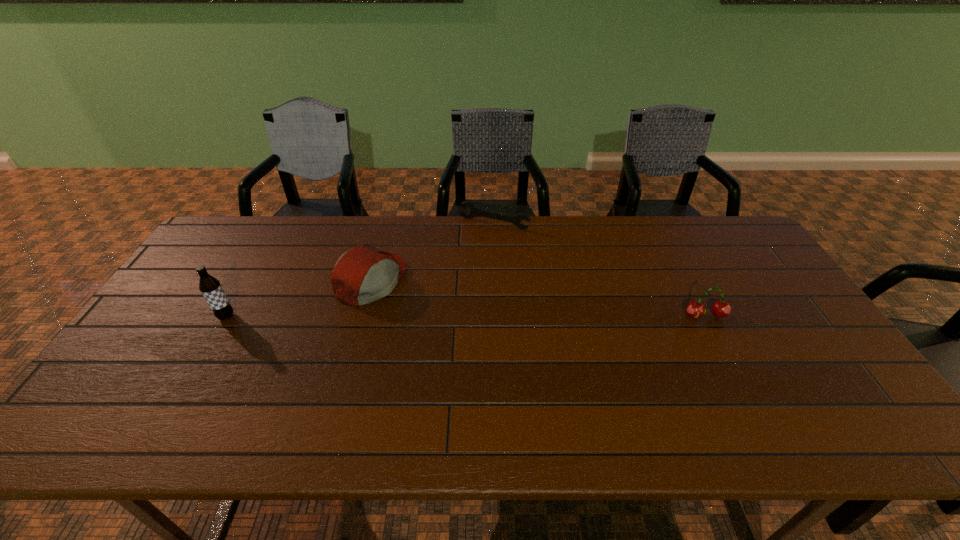
Find the location of a particular element. Image resolution: width=960 pixels, height=540 pixels. free region located on the front-facing side of the third object from right to left is located at coordinates (506, 341).

At what (x,y) coordinates should I click in order to perform the action: click on vacant space situated 0.370m on the front-facing side of the third object from right to left. Please return your answer as a coordinate pair (x, y). Looking at the image, I should click on (509, 343).

Where is `vacant space located 0.120m on the open ends of the wrench`? vacant space located 0.120m on the open ends of the wrench is located at coordinates (469, 251).

Image resolution: width=960 pixels, height=540 pixels. In order to click on vacant region located 0.350m on the open ends of the wrench in this screenshot , I will do `click(442, 298)`.

Where is `vacant region located 0.120m on the open ends of the wrench`? The image size is (960, 540). vacant region located 0.120m on the open ends of the wrench is located at coordinates (469, 251).

I want to click on cap located at the far edge, so click(x=361, y=275).

Where is `wrench positioned at the far edge`? This screenshot has width=960, height=540. wrench positioned at the far edge is located at coordinates (474, 211).

Find the location of a particular element. The image size is (960, 540). blank area at the far edge is located at coordinates 348,218.

The width and height of the screenshot is (960, 540). I want to click on vacant space at the near edge of the desktop, so click(x=222, y=402).

In the image, there is a desktop. Where is `vacant space at the left edge`? This screenshot has height=540, width=960. vacant space at the left edge is located at coordinates (208, 268).